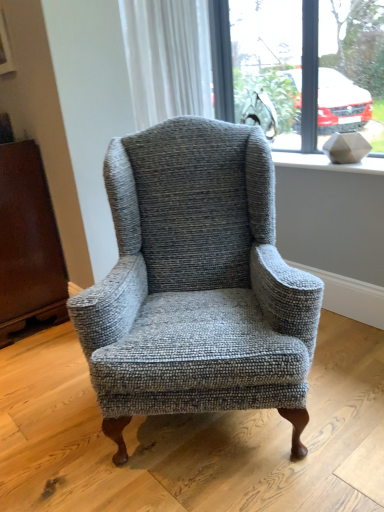
Find the location of a particular element. vacant space situated on the left part of textured gray armchair at center is located at coordinates (49, 404).